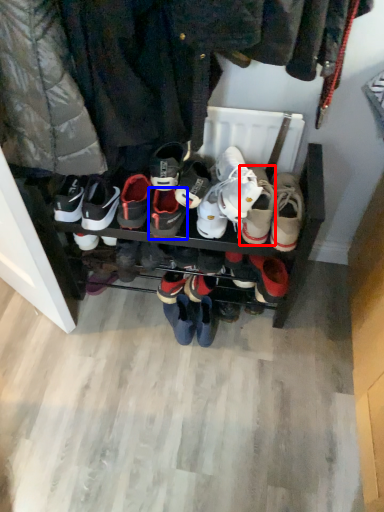
Question: Which point is further to the camera, footwear (highlighted by a red box) or footwear (highlighted by a blue box)?

Choices:
 (A) footwear
 (B) footwear

Answer: (B)